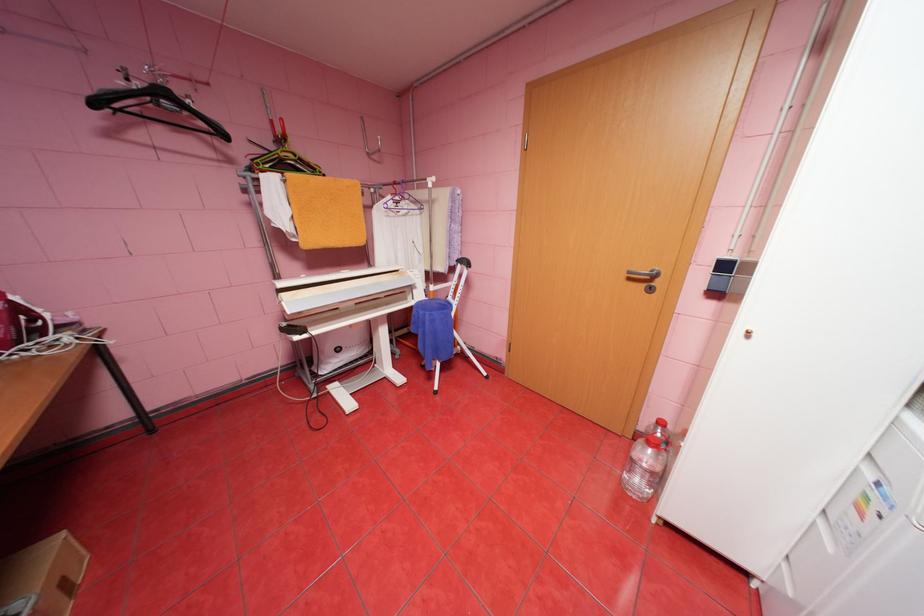
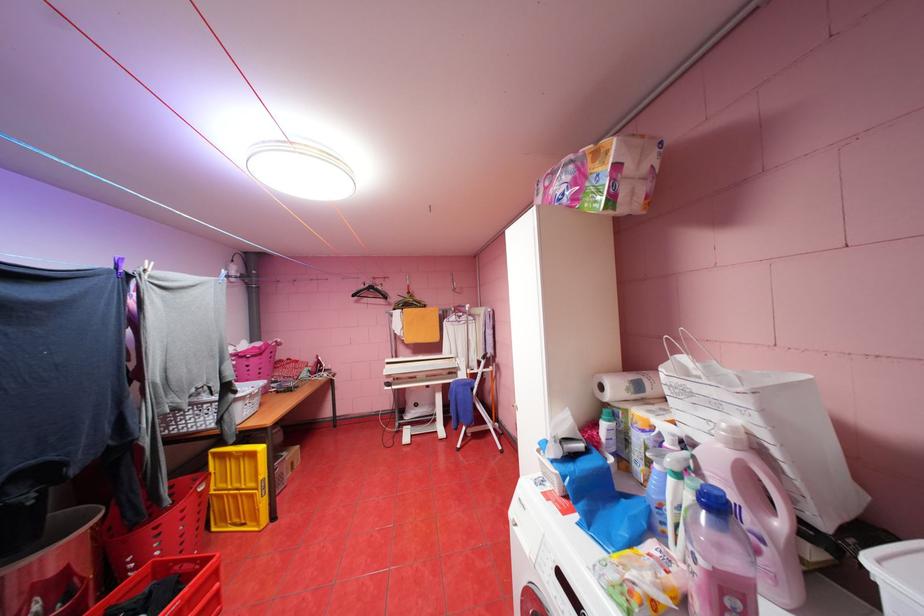
Where in the second image is the point corresponding to (103,103) from the first image?

(361, 294)